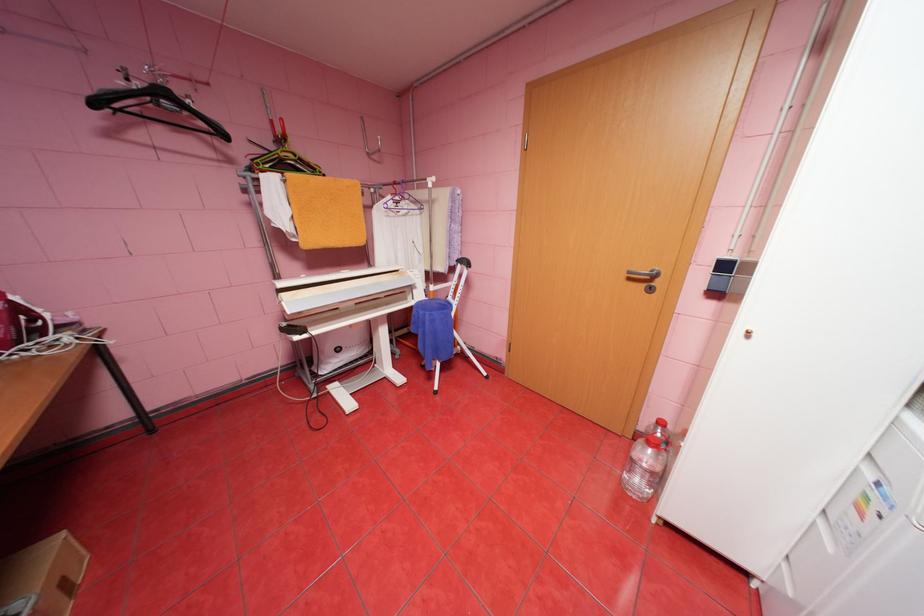
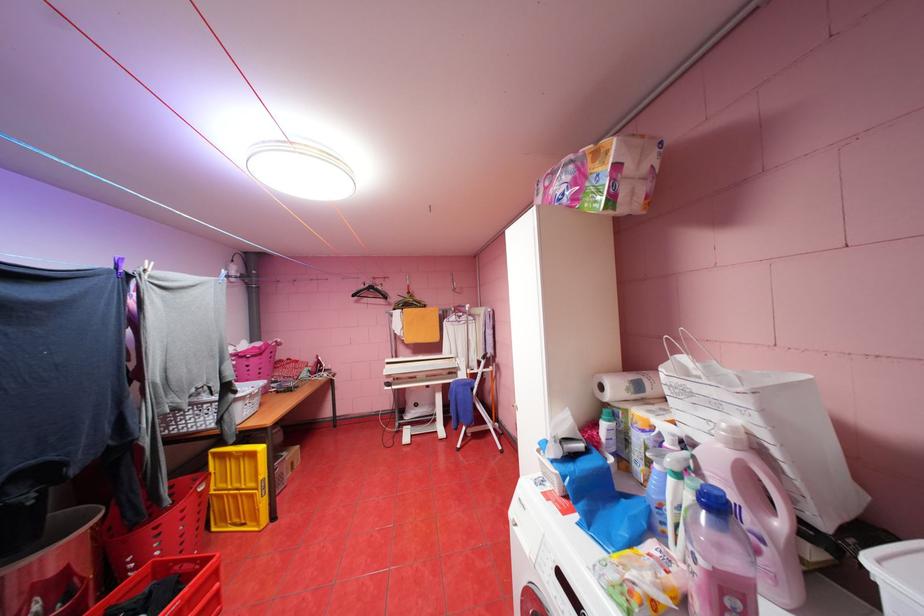
Where in the second image is the point corresponding to (103,103) from the first image?

(361, 294)